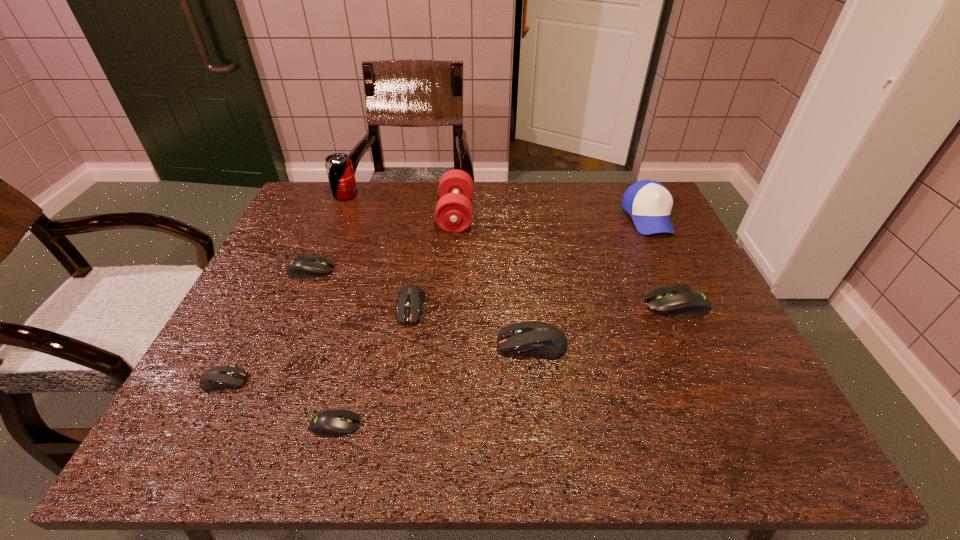
I want to click on soda can, so pyautogui.click(x=339, y=168).

The height and width of the screenshot is (540, 960). In order to click on dumbbell in this screenshot , I will do `click(454, 212)`.

Locate an element on the screen. baseball cap is located at coordinates (649, 203).

Locate an element on the screen. The image size is (960, 540). the third object from right to left is located at coordinates (538, 339).

Identify the location of the fourth farthest computer mouse. This screenshot has width=960, height=540. (538, 339).

I want to click on the rightmost gray computer mouse, so click(x=684, y=301).

At what (x,y) coordinates should I click in order to perform the action: click on the second farthest gray computer mouse. Please return your answer as a coordinate pair (x, y). Image resolution: width=960 pixels, height=540 pixels. Looking at the image, I should click on (684, 301).

Find the location of a particular element. The height and width of the screenshot is (540, 960). the second smallest dark computer equipment is located at coordinates (410, 299).

Locate an element on the screen. The image size is (960, 540). the second dark computer equipment from right to left is located at coordinates [410, 299].

You are a GUI agent. You are given a task and a screenshot of the screen. Output one action in this format:
    pyautogui.click(x=<x>, y=<y>)
    Task: Click on the sixth nearest object
    This screenshot has height=540, width=960.
    Given the screenshot: What is the action you would take?
    pyautogui.click(x=306, y=266)